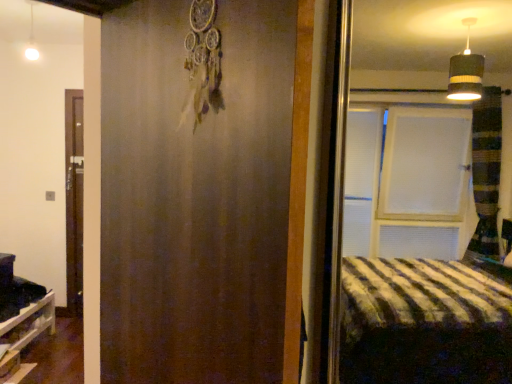
Question: Is matte brown barn door at center closer to the viewer compared to white wooden shelf at lower left?

Choices:
 (A) no
 (B) yes

Answer: (B)

Question: Is white wooden shelf at lower left completely or partially inside matte brown barn door at center?

Choices:
 (A) no
 (B) yes

Answer: (A)

Question: From the image's perspective, is matte brown barn door at center located above white wooden shelf at lower left?

Choices:
 (A) no
 (B) yes

Answer: (B)

Question: Is matte brown barn door at center behind white wooden shelf at lower left?

Choices:
 (A) yes
 (B) no

Answer: (B)

Question: Is matte brown barn door at center at the right side of white wooden shelf at lower left?

Choices:
 (A) no
 (B) yes

Answer: (B)

Question: Considering the positions of white wooden shelf at lower left and matte brown barn door at center in the image, is white wooden shelf at lower left bigger or smaller than matte brown barn door at center?

Choices:
 (A) big
 (B) small

Answer: (B)

Question: From a real-world perspective, is white wooden shelf at lower left above or below matte brown barn door at center?

Choices:
 (A) below
 (B) above

Answer: (A)

Question: From the image's perspective, is white wooden shelf at lower left above or below matte brown barn door at center?

Choices:
 (A) above
 (B) below

Answer: (B)

Question: Is white wooden shelf at lower left wider or thinner than matte brown barn door at center?

Choices:
 (A) thin
 (B) wide

Answer: (B)

Question: From a real-world perspective, relative to white wooden shelf at lower left, is white glossy light fixture at upper left vertically above or below?

Choices:
 (A) above
 (B) below

Answer: (A)

Question: Relative to white wooden shelf at lower left, is white glossy light fixture at upper left in front or behind?

Choices:
 (A) behind
 (B) front

Answer: (B)

Question: Is point (30, 21) closer or farther from the camera than point (25, 370)?

Choices:
 (A) closer
 (B) farther

Answer: (B)

Question: In terms of size, does white glossy light fixture at upper left appear bigger or smaller than white wooden shelf at lower left?

Choices:
 (A) small
 (B) big

Answer: (A)

Question: Is point (27, 51) positioned closer to the camera than point (266, 271)?

Choices:
 (A) closer
 (B) farther

Answer: (B)

Question: From the image's perspective, is white glossy light fixture at upper left above or below matte brown barn door at center?

Choices:
 (A) above
 (B) below

Answer: (A)